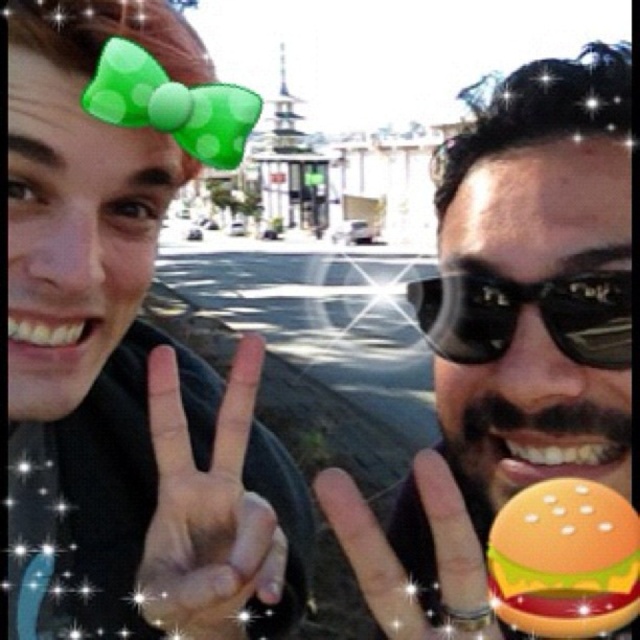
Question: Which object is positioned closest to the green polka dot bow at upper left?

Choices:
 (A) gold metallic ring at center
 (B) orange matte burger at right
 (C) orange plastic burger at lower right
 (D) black reflective sunglasses at right

Answer: (A)

Question: Estimate the real-world distances between objects in this image. Which object is closer to the black matte hand at center?

Choices:
 (A) black reflective sunglasses at right
 (B) green polka dot bow at upper left

Answer: (B)

Question: Which of these objects is positioned closest to the black reflective sunglasses at right?

Choices:
 (A) orange plastic burger at lower right
 (B) gold metallic ring at center
 (C) orange matte burger at right

Answer: (C)

Question: In this image, where is orange matte burger at right located relative to orange plastic burger at lower right?

Choices:
 (A) left
 (B) right

Answer: (A)

Question: Is the position of green polka dot bow at upper left less distant than that of black reflective sunglasses at right?

Choices:
 (A) yes
 (B) no

Answer: (A)

Question: Does orange plastic burger at lower right have a larger size compared to black reflective sunglasses at right?

Choices:
 (A) yes
 (B) no

Answer: (B)